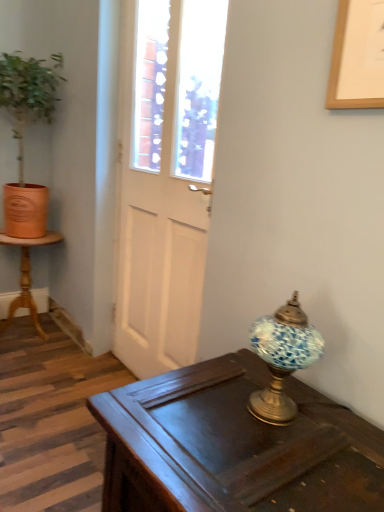
Locate an element on the screen. Image resolution: width=384 pixels, height=512 pixels. free space on the front side of blue mosaic glass lamp at right is located at coordinates (293, 463).